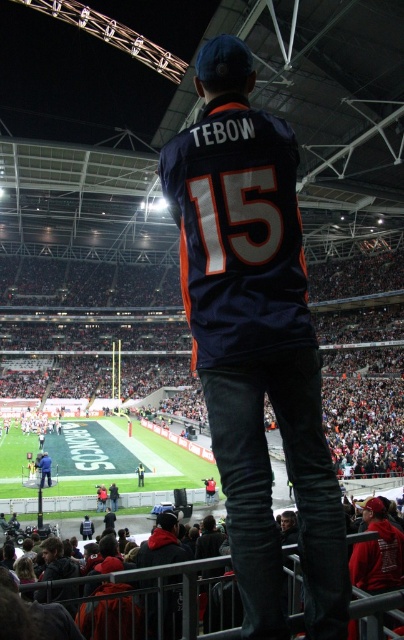
Question: Which of the following is the farthest from the observer?

Choices:
 (A) navy blue jersey at center
 (B) dark blue jersey at center

Answer: (B)

Question: Does navy blue jersey at center appear on the right side of blue jersey at center?

Choices:
 (A) no
 (B) yes

Answer: (B)

Question: Does navy blue jersey at center have a lesser width compared to blue jersey at center?

Choices:
 (A) no
 (B) yes

Answer: (A)

Question: Which object is the closest to the blue jersey at center?

Choices:
 (A) navy blue jersey at center
 (B) dark blue jersey at center

Answer: (B)

Question: Among these points, which one is farthest from the camera?

Choices:
 (A) (42, 472)
 (B) (180, 205)

Answer: (A)

Question: Can you confirm if dark blue jersey at center is positioned above blue jersey at center?

Choices:
 (A) yes
 (B) no

Answer: (A)